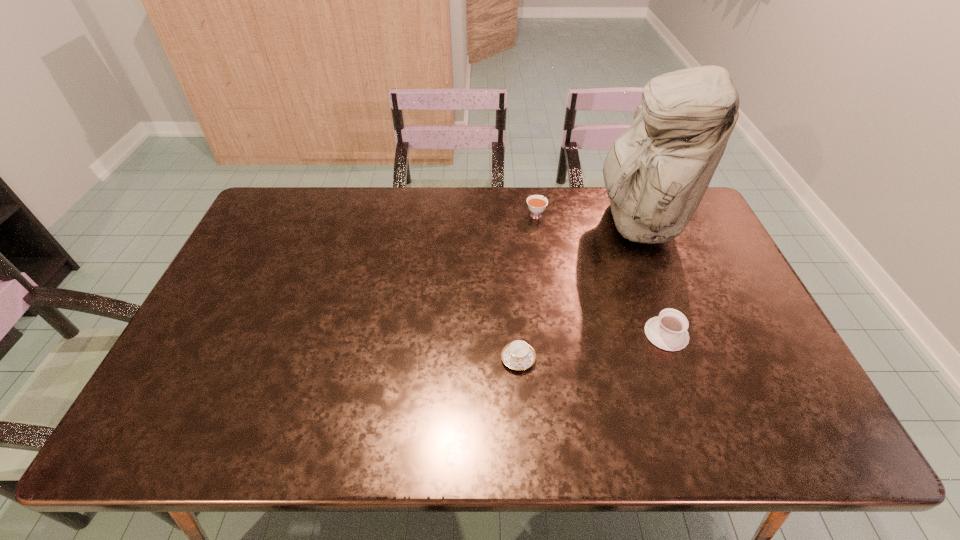
Locate an element on the screen. free space that satisfies the following two spatial constraints: 1. on the front-facing side of the backpack; 2. on the side with the handle of the leftmost teacup is located at coordinates (691, 359).

Locate an element on the screen. Image resolution: width=960 pixels, height=540 pixels. free space in the image that satisfies the following two spatial constraints: 1. on the front-facing side of the tallest object; 2. on the side with the handle of the leftmost teacup is located at coordinates (691, 359).

The height and width of the screenshot is (540, 960). What are the coordinates of `vacant space that satisfies the following two spatial constraints: 1. on the front-facing side of the backpack; 2. on the side with the handle of the leftmost teacup` in the screenshot? It's located at (691, 359).

Find the location of a particular element. Image resolution: width=960 pixels, height=540 pixels. free space in the image that satisfies the following two spatial constraints: 1. on the front-facing side of the tallest object; 2. on the side with the handle of the shortest teacup is located at coordinates (691, 359).